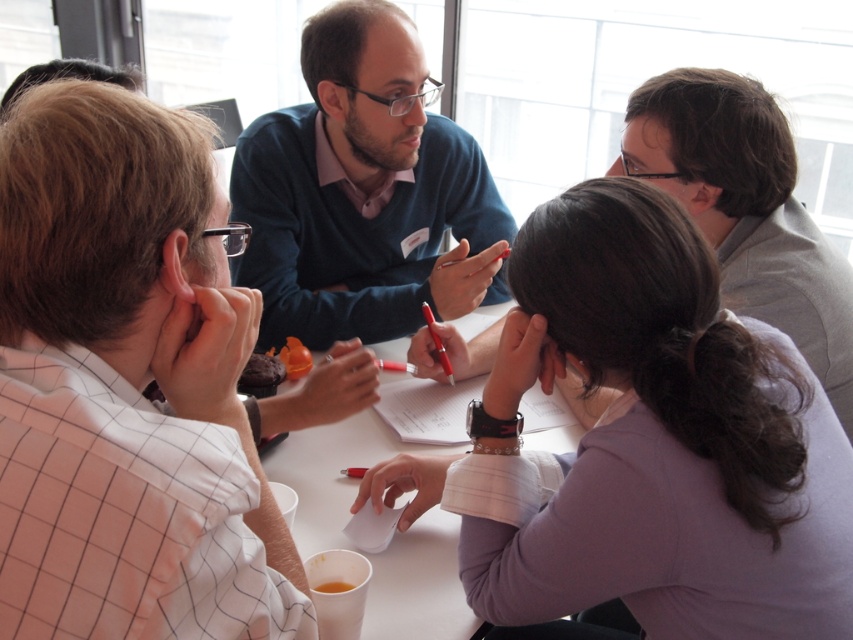
Is point (775, 541) in front of point (751, 177)?

Yes.

Measure the distance between purple fabric shirt at center and matte blue sweater at upper center.

purple fabric shirt at center and matte blue sweater at upper center are 15.46 inches apart.

Locate an element on the screen. purple fabric shirt at center is located at coordinates (662, 445).

Where is `purple fabric shirt at center`? The width and height of the screenshot is (853, 640). purple fabric shirt at center is located at coordinates (x=662, y=445).

Between purple fabric shirt at center and white paper at center, which one appears on the right side from the viewer's perspective?

Positioned to the right is purple fabric shirt at center.

Is purple fabric shirt at center positioned behind white paper at center?

That is False.

Is point (732, 508) behind point (368, 435)?

No, (732, 508) is in front of (368, 435).

Where is `purple fabric shirt at center`? purple fabric shirt at center is located at coordinates (662, 445).

Is white checkered shirt at left behind purple fabric shirt at center?

No, white checkered shirt at left is in front of purple fabric shirt at center.

Does point (97, 170) come in front of point (631, 211)?

Yes, it is in front of point (631, 211).

Where is `white checkered shirt at left`? Image resolution: width=853 pixels, height=640 pixels. white checkered shirt at left is located at coordinates (120, 385).